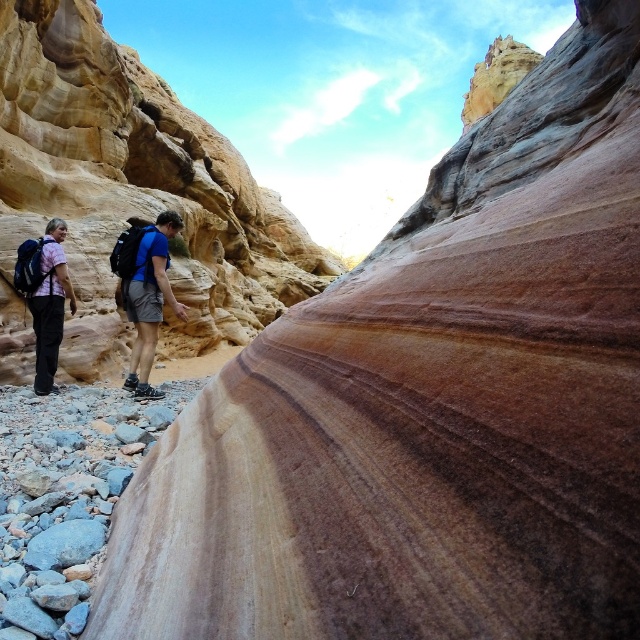
Based on the photo, which is more to the left, blue fabric backpack at center or matte pink shirt at left?

matte pink shirt at left is more to the left.

Measure the distance from blue fabric backpack at center to matte pink shirt at left.

The distance of blue fabric backpack at center from matte pink shirt at left is 38.40 feet.

I want to click on blue fabric backpack at center, so click(x=145, y=291).

Identify the location of blue fabric backpack at center. (145, 291).

Does matte blue shirt at center appear on the left side of blue fabric backpack at center?

Yes, matte blue shirt at center is to the left of blue fabric backpack at center.

Who is taller, matte blue shirt at center or blue fabric backpack at center?

Standing taller between the two is blue fabric backpack at center.

Does point (115, 253) come behind point (173, 304)?

No, (115, 253) is in front of (173, 304).

Find the location of a particular element. Image resolution: width=640 pixels, height=640 pixels. matte blue shirt at center is located at coordinates (145, 291).

Does matte blue shirt at center appear on the right side of matte pink shirt at left?

Yes, matte blue shirt at center is to the right of matte pink shirt at left.

Does matte blue shirt at center have a lesser height compared to matte pink shirt at left?

In fact, matte blue shirt at center may be taller than matte pink shirt at left.

Between point (42, 374) and point (64, 301), which one is positioned behind?

Positioned behind is point (64, 301).

In order to click on matte blue shirt at center in this screenshot , I will do `click(145, 291)`.